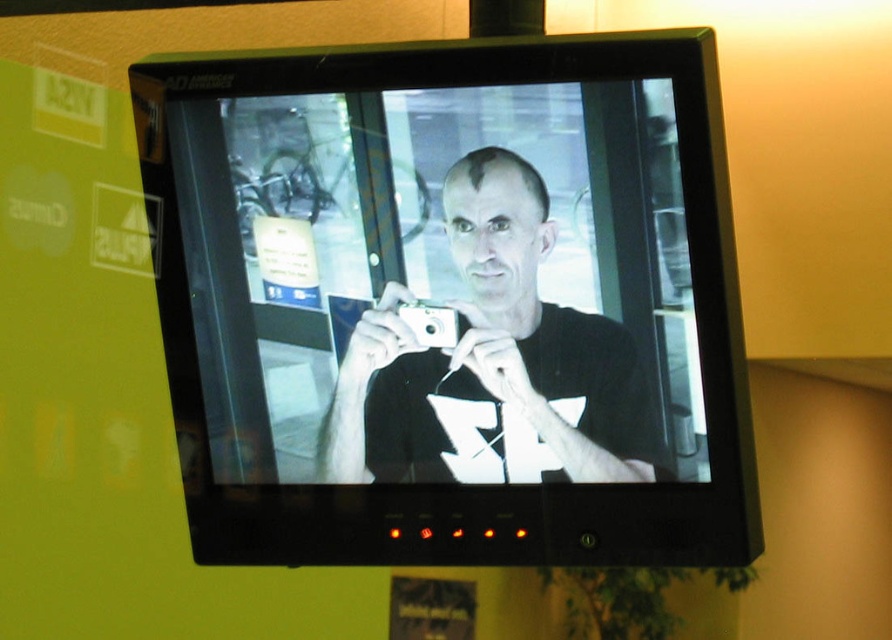
Based on the photo, which of these two, black glossy monitor at center or white glossy camera at center, stands taller?

black glossy monitor at center

Identify the location of black glossy monitor at center. (451, 301).